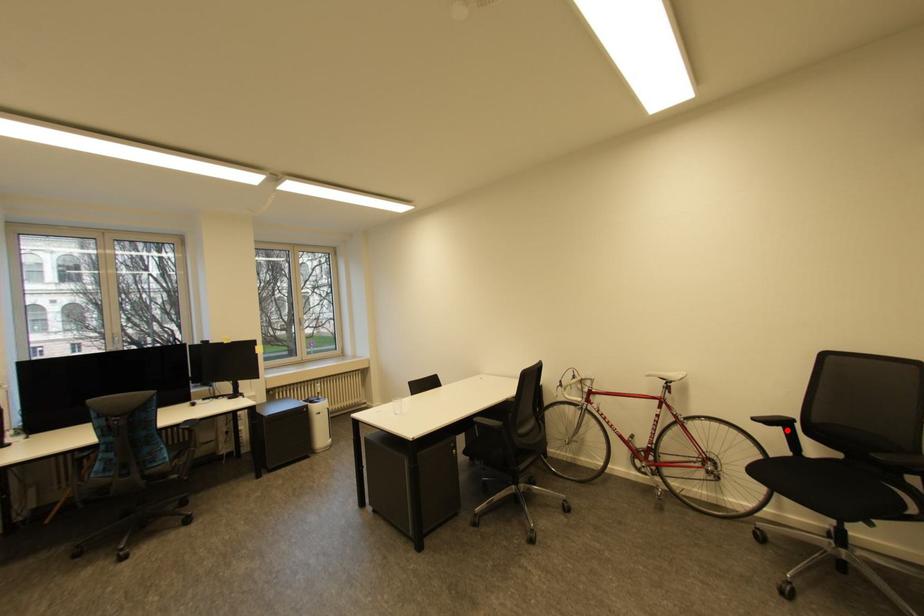
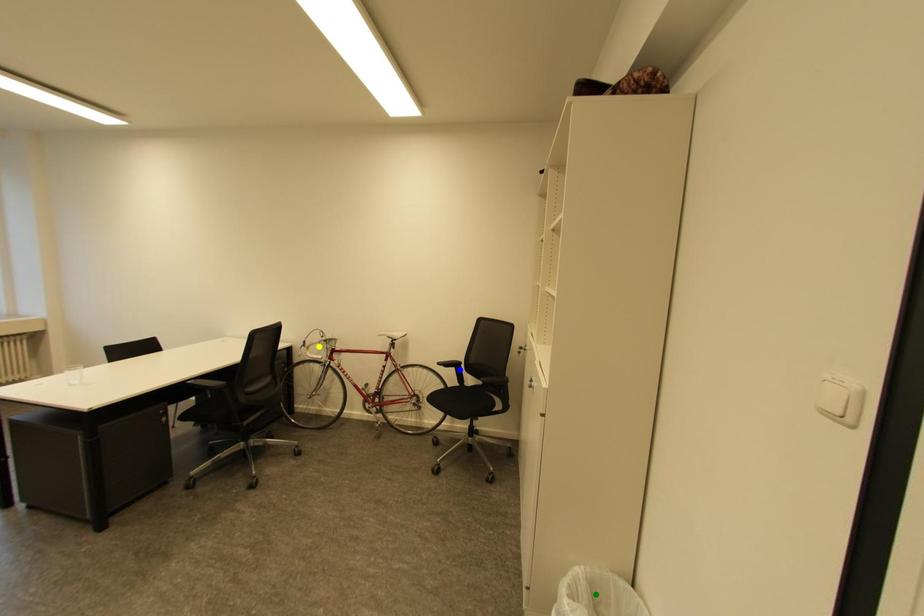
Question: I am providing you with two images of the same scene from different viewpoints. A red point is marked on the first image. You are given multiple points on the second image. Which spot in image 2 lines up with the point in image 1?

Choices:
 (A) yellow point
 (B) green point
 (C) blue point

Answer: (C)